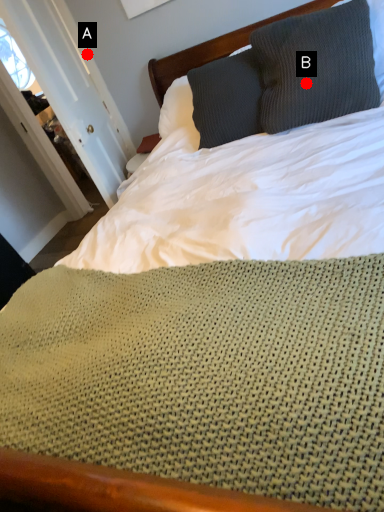
Question: Two points are circled on the image, labeled by A and B beside each circle. Which point appears closest to the camera in this image?

Choices:
 (A) A is closer
 (B) B is closer

Answer: (B)